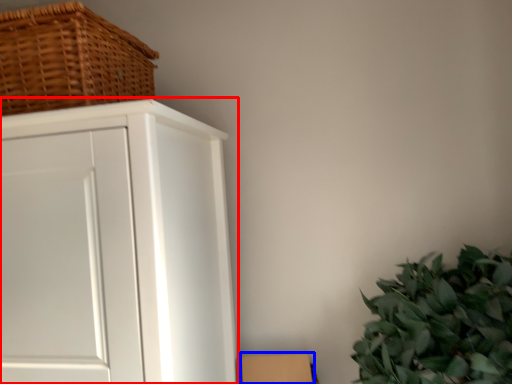
Question: Which object appears closest to the camera in this image, cupboard (highlighted by a red box) or cardboard box (highlighted by a blue box)?

Choices:
 (A) cupboard
 (B) cardboard box

Answer: (A)